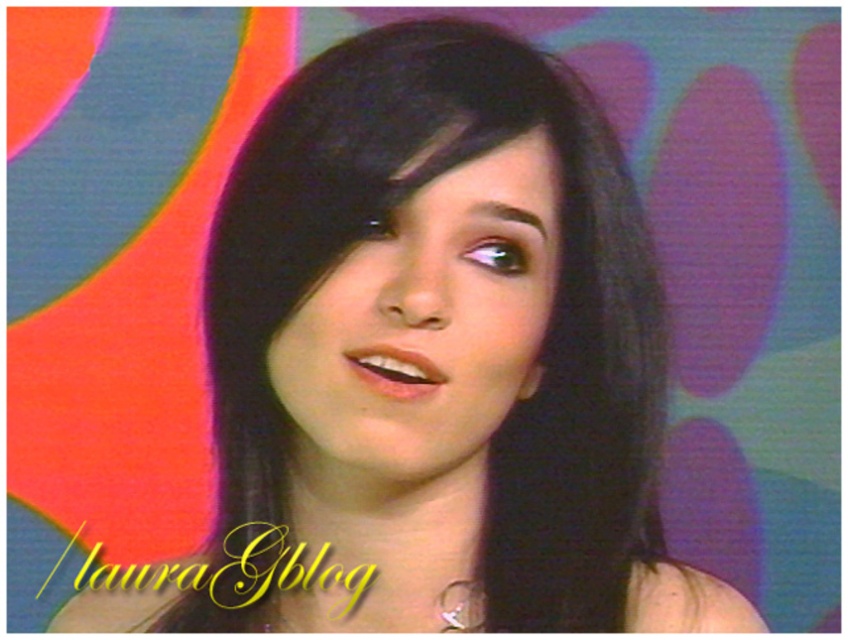
You are an artist analyzing the composition of this image. You notice the smooth skin face at center and the silver metallic earring at lower center. Which object occupies more space in the image?

The smooth skin face at center has a larger size compared to the silver metallic earring at lower center, so it occupies more space in the image.

You are a photographer adjusting your camera settings for a portrait. The subject has a smooth skin face at center. If your camera requires the subject to be at least 50 centimeters away to avoid distortion, is the current distance sufficient?

The smooth skin face at center is only 41.29 centimeters away from the camera, which is closer than the required 50 centimeters. Therefore, the current distance is not sufficient to avoid distortion.

You are an artist trying to sketch the scene. You need to decide the relative sizes of the objects. Is the smooth skin face at center wider than the silver metallic earring at lower center?

The smooth skin face at center might be wider than silver metallic earring at lower center according to the description.